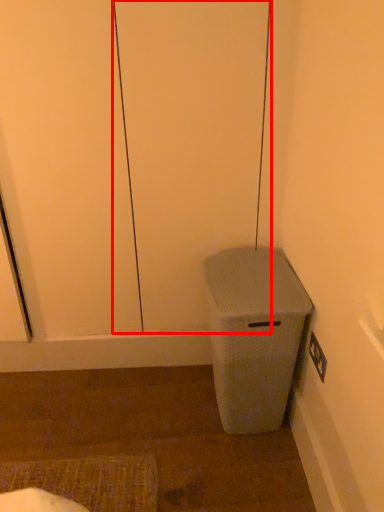
Question: From the image's perspective, where is screen door (annotated by the red box) located relative to waste container?

Choices:
 (A) above
 (B) below

Answer: (A)